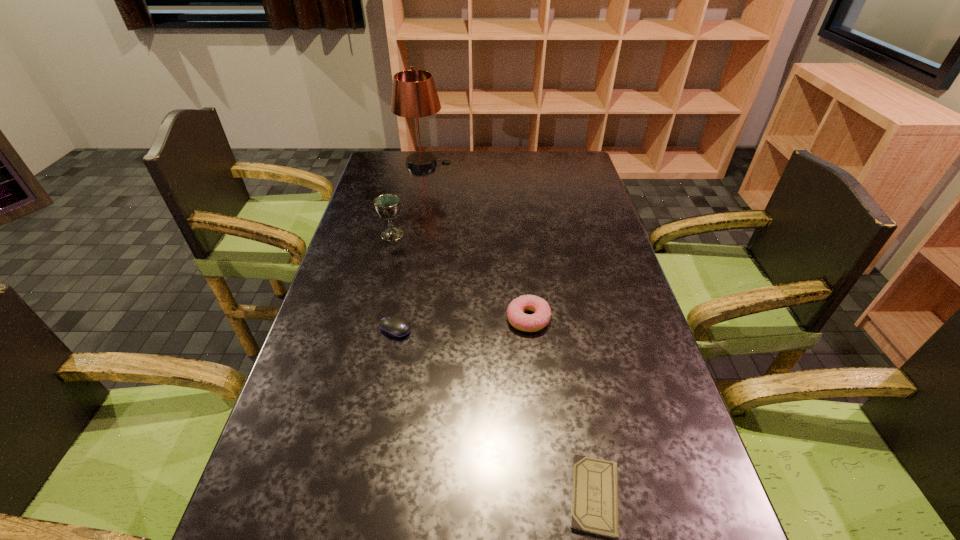
Locate an element on the screen. free point between the chalice and the fourth tallest object is located at coordinates (394, 282).

Where is `the closest object to the fourth nearest object`? This screenshot has width=960, height=540. the closest object to the fourth nearest object is located at coordinates (395, 326).

Identify the location of object that is the second closest to the farthest object. This screenshot has width=960, height=540. (517, 318).

Identify the location of vacant region that satisfies the following two spatial constraints: 1. on the front-facing side of the shortest object; 2. on the right side of the farthest object. The image size is (960, 540). (359, 496).

Find the location of `free space that satisfies the following two spatial constraints: 1. on the front-facing side of the nearest object; 2. on the left side of the farthest object`. free space that satisfies the following two spatial constraints: 1. on the front-facing side of the nearest object; 2. on the left side of the farthest object is located at coordinates (359, 496).

Find the location of a particular element. vacant space that satisfies the following two spatial constraints: 1. on the front-facing side of the third shortest object; 2. on the left side of the lampshade is located at coordinates (394, 319).

In order to click on free space that satisfies the following two spatial constraints: 1. on the front-facing side of the lampshade; 2. on the back side of the doughnut in this screenshot , I will do `click(394, 319)`.

At what (x,y) coordinates should I click in order to perform the action: click on free space that satisfies the following two spatial constraints: 1. on the front-facing side of the tallest object; 2. on the back side of the computer mouse. Please return your answer as a coordinate pair (x, y). Looking at the image, I should click on tap(392, 328).

The height and width of the screenshot is (540, 960). In order to click on free point that satisfies the following two spatial constraints: 1. on the back side of the computer mouse; 2. on the front-facing side of the lampshade in this screenshot , I will do `click(426, 164)`.

Identify the location of free spot that satisfies the following two spatial constraints: 1. on the back side of the computer mouse; 2. on the front-facing side of the tallest object. The width and height of the screenshot is (960, 540). (426, 164).